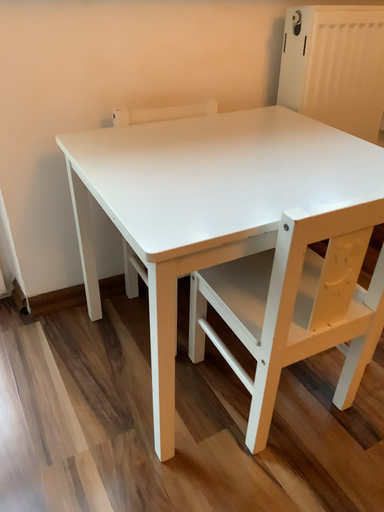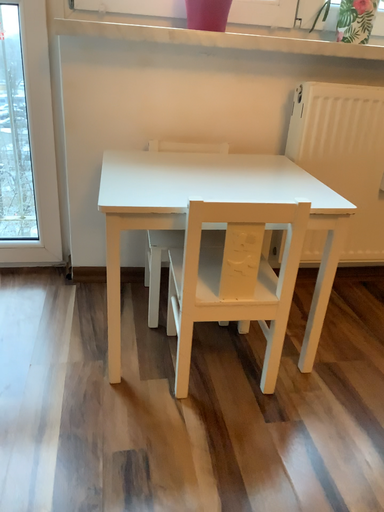
Question: Which way did the camera rotate in the video?

Choices:
 (A) rotated left
 (B) rotated right

Answer: (A)